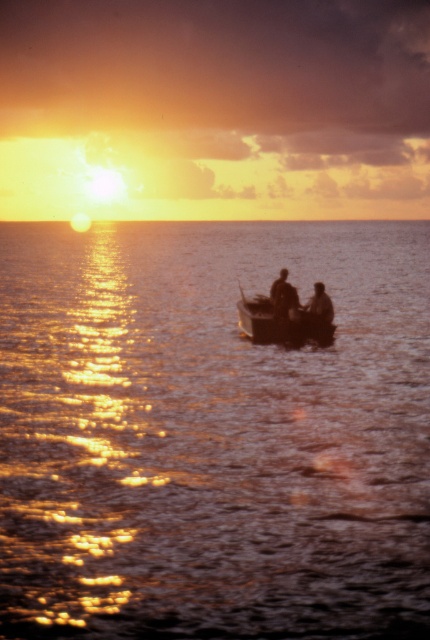
Is dark brown wooden boat at center wider than smooth skin face at center?

Indeed, dark brown wooden boat at center has a greater width compared to smooth skin face at center.

In the scene shown: Between dark brown wooden boat at center and smooth skin face at center, which one has less height?

Standing shorter between the two is smooth skin face at center.

The image size is (430, 640). Describe the element at coordinates (283, 320) in the screenshot. I see `dark brown wooden boat at center` at that location.

This screenshot has width=430, height=640. I want to click on dark brown wooden boat at center, so click(x=283, y=320).

Does glistening water at center have a lesser height compared to dark brown wooden boat at center?

In fact, glistening water at center may be taller than dark brown wooden boat at center.

Is point (82, 474) farther from camera compared to point (248, 324)?

No, (82, 474) is closer to viewer.

Find the location of a particular element. The image size is (430, 640). glistening water at center is located at coordinates click(x=211, y=433).

Is smooth wooden boat at center to the right of silhouette wooden boat at center from the viewer's perspective?

Indeed, smooth wooden boat at center is positioned on the right side of silhouette wooden boat at center.

Based on the photo, does smooth wooden boat at center have a larger size compared to silhouette wooden boat at center?

Correct, smooth wooden boat at center is larger in size than silhouette wooden boat at center.

Locate an element on the screen. smooth wooden boat at center is located at coordinates (297, 298).

Locate an element on the screen. smooth wooden boat at center is located at coordinates (297, 298).